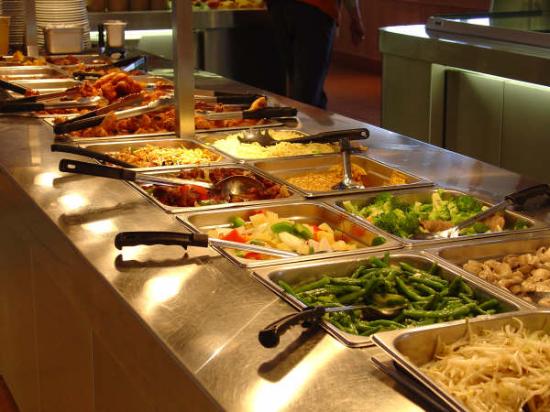
Image resolution: width=550 pixels, height=412 pixels. Find the location of `plates`. plates is located at coordinates (62, 10).